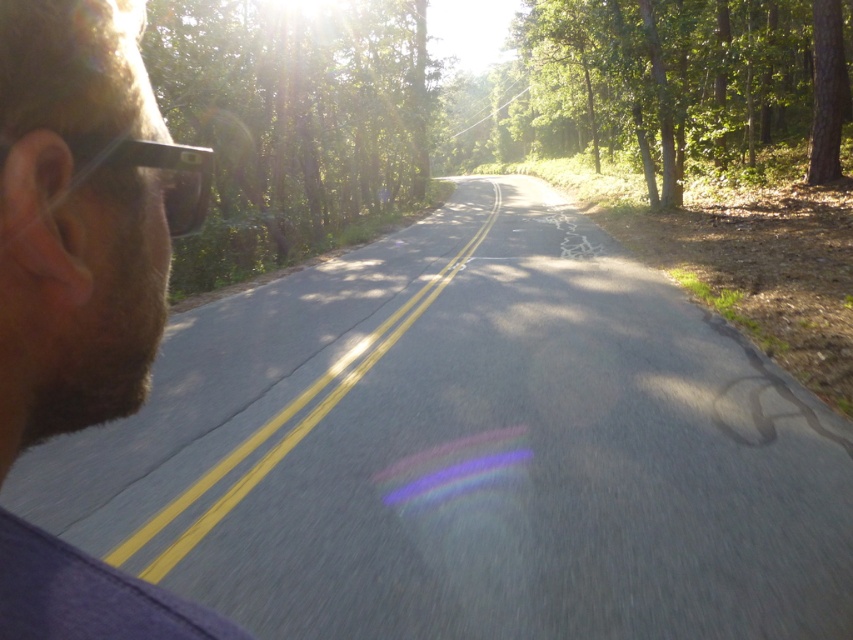
Question: Which point is farther from the camera taking this photo?

Choices:
 (A) (636, 124)
 (B) (318, 65)

Answer: (B)

Question: Among these objects, which one is farthest from the camera?

Choices:
 (A) green leafy tree at upper right
 (B) transparent plastic glasses at left
 (C) green leafy tree at upper center
 (D) beige hair at left

Answer: (A)

Question: Does green leafy tree at upper center appear on the left side of green leafy tree at upper right?

Choices:
 (A) no
 (B) yes

Answer: (B)

Question: Is green leafy tree at upper center positioned before transparent plastic glasses at left?

Choices:
 (A) yes
 (B) no

Answer: (B)

Question: Is beige hair at left wider than green leafy tree at upper right?

Choices:
 (A) yes
 (B) no

Answer: (B)

Question: Which point is farther to the camera?

Choices:
 (A) (556, 99)
 (B) (370, 81)
 (C) (165, 189)

Answer: (A)